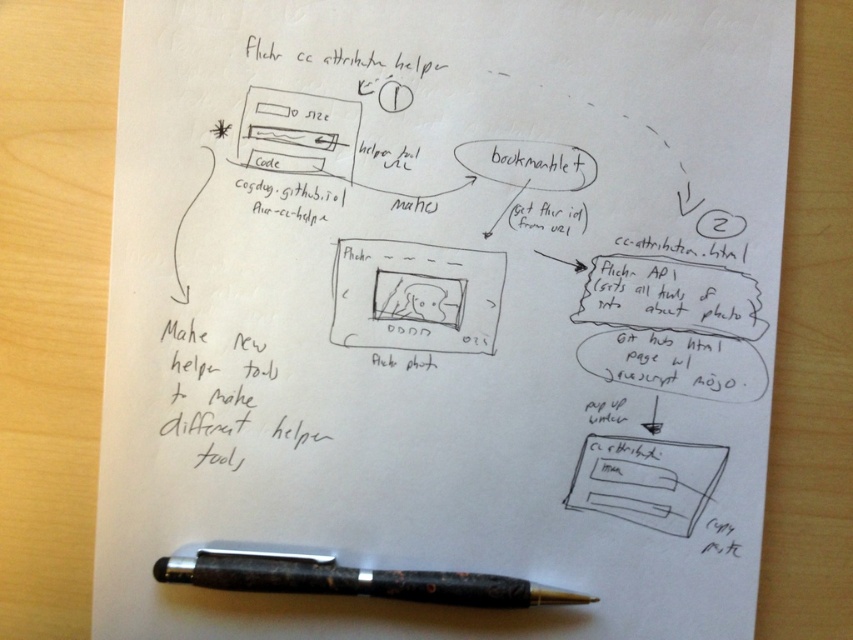
Question: Does black textured pen at bottom appear on the right side of white paper at bottom right?

Choices:
 (A) yes
 (B) no

Answer: (B)

Question: Is black textured pen at bottom smaller than white paper at bottom right?

Choices:
 (A) no
 (B) yes

Answer: (A)

Question: Can you confirm if black textured pen at bottom is bigger than white paper at bottom right?

Choices:
 (A) yes
 (B) no

Answer: (A)

Question: Which point is closer to the camera?

Choices:
 (A) (711, 444)
 (B) (419, 580)

Answer: (B)

Question: Among these points, which one is farthest from the camera?

Choices:
 (A) (624, 442)
 (B) (537, 588)

Answer: (A)